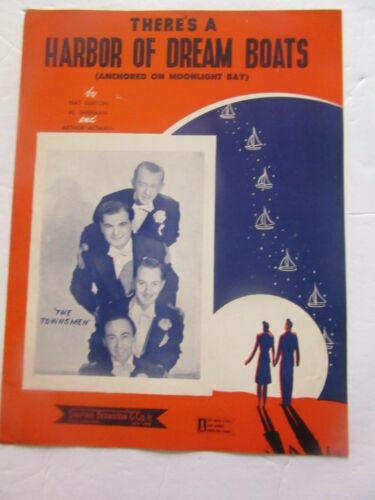
At what (x,y) coordinates should I click in order to perform the action: click on playbill. Please return your answer as a coordinate pair (x, y). Looking at the image, I should click on click(131, 104).